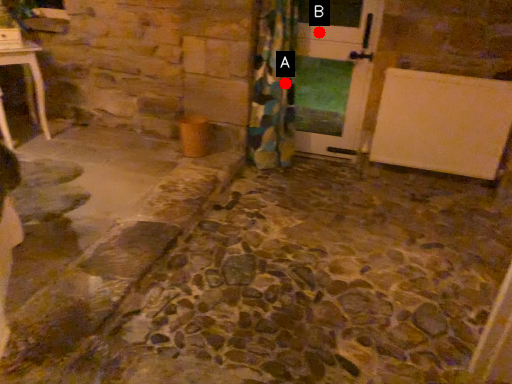
Question: Two points are circled on the image, labeled by A and B beside each circle. Among these points, which one is nearest to the camera?

Choices:
 (A) A is closer
 (B) B is closer

Answer: (B)